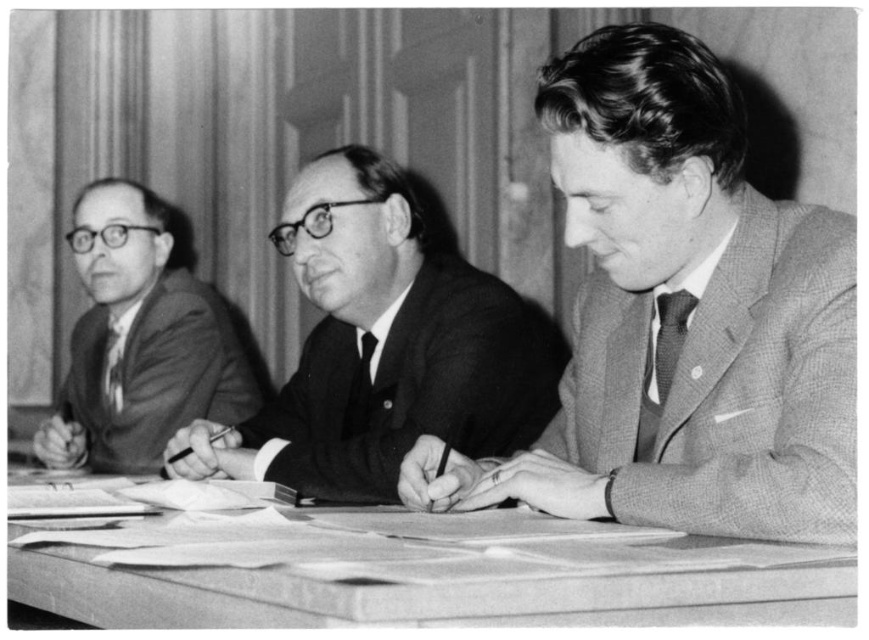
Who is lower down, smooth wood table at center or patterned fabric tie at center?

smooth wood table at center is below.

Measure the distance between point (745,566) and camera.

The distance of point (745,566) from camera is 30.48 inches.

Is point (20, 577) closer to camera compared to point (662, 348)?

Yes, it is.

Identify the location of smooth wood table at center. (397, 570).

This screenshot has width=869, height=640. Find the location of `smooth black suit at center`. smooth black suit at center is located at coordinates (382, 348).

Does smooth black suit at center have a smaller size compared to black silk tie at center?

Incorrect, smooth black suit at center is not smaller in size than black silk tie at center.

Which is behind, point (327, 492) or point (363, 333)?

Positioned behind is point (363, 333).

Image resolution: width=869 pixels, height=640 pixels. Find the location of `smooth black suit at center`. smooth black suit at center is located at coordinates (382, 348).

Who is more distant from viewer, (813,468) or (110,548)?

The point (813,468) is more distant.

Can you confirm if textured gray suit at center is smaller than smooth wood table at center?

Actually, textured gray suit at center might be larger than smooth wood table at center.

Between point (687, 65) and point (592, 604), which one is positioned in front?

Point (592, 604) is in front.

At what (x,y) coordinates should I click in order to perform the action: click on textured gray suit at center. Please return your answer as a coordinate pair (x, y). Looking at the image, I should click on (688, 317).